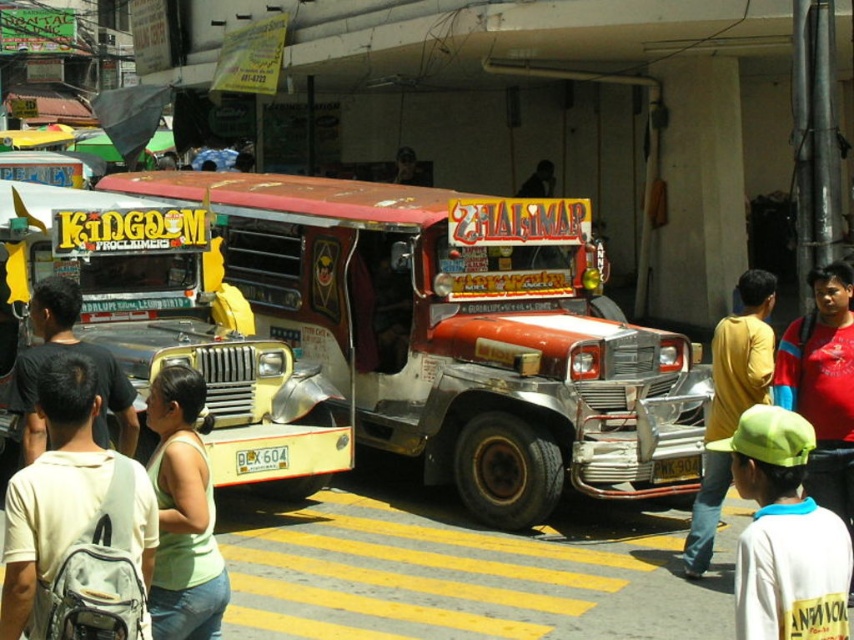
Question: In this image, where is yellow matte jeepney at left located relative to yellow shirt at center?

Choices:
 (A) right
 (B) left

Answer: (B)

Question: Among these points, which one is farthest from the camera?

Choices:
 (A) (56, 282)
 (B) (790, 348)
 (C) (411, 352)
 (D) (4, 624)

Answer: (C)

Question: Can you confirm if white fabric backpack at lower left is positioned to the right of light green shirt at center?

Choices:
 (A) yes
 (B) no

Answer: (A)

Question: Can you confirm if light green fabric at center is thinner than light green shirt at center?

Choices:
 (A) yes
 (B) no

Answer: (A)

Question: Which point is closer to the camera?

Choices:
 (A) pyautogui.click(x=34, y=320)
 (B) pyautogui.click(x=80, y=392)
 (C) pyautogui.click(x=541, y=490)
 (D) pyautogui.click(x=329, y=451)

Answer: (B)

Question: Among these objects, which one is nearest to the camera?

Choices:
 (A) light green shirt at center
 (B) white cotton shirt at lower right
 (C) light green fabric at center
 (D) red matte shirt at center right

Answer: (B)